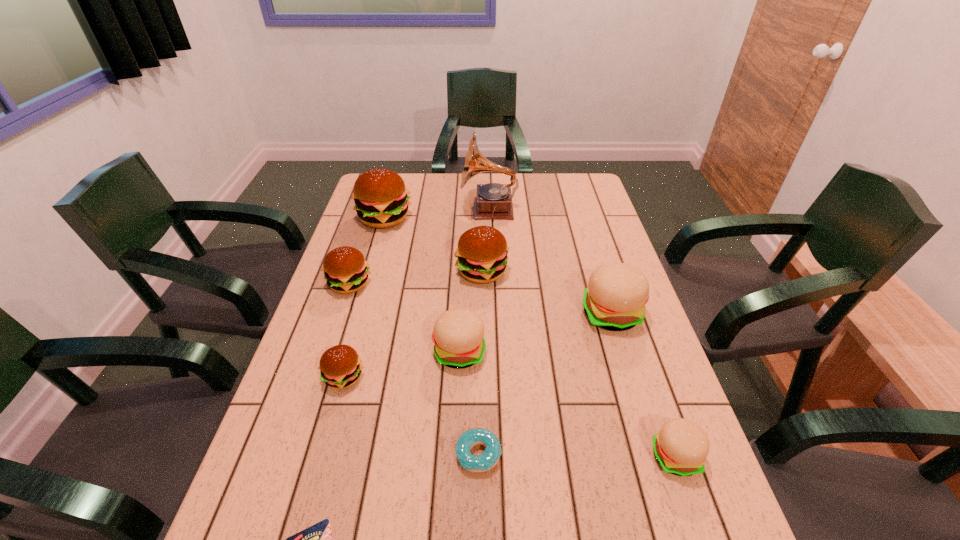
Where is `doughnut`? The image size is (960, 540). doughnut is located at coordinates (489, 458).

The image size is (960, 540). I want to click on vacant space located 0.110m on the horn of the tallest object, so click(431, 210).

The height and width of the screenshot is (540, 960). Identify the location of vacant space located 0.290m on the horn of the tallest object. (381, 210).

The height and width of the screenshot is (540, 960). Identify the location of vacant region located 0.150m on the horn of the tallest object. (420, 210).

At what (x,y) coordinates should I click in order to perform the action: click on vacant region located on the right of the ninth shortest object. Please return your answer as a coordinate pair (x, y). Image resolution: width=960 pixels, height=540 pixels. Looking at the image, I should click on (464, 219).

The image size is (960, 540). I want to click on free space located 0.340m on the left of the rightmost brown hamburger, so click(x=343, y=272).

Find the location of `vacant region located 0.160m on the back of the biggest beige hamburger`. vacant region located 0.160m on the back of the biggest beige hamburger is located at coordinates (594, 259).

Find the location of a particular element. free point located on the back of the third biggest brown hamburger is located at coordinates (x=365, y=239).

At what (x,y) coordinates should I click in order to perform the action: click on free region located on the right of the leftmost beige hamburger. Please return your answer as a coordinate pair (x, y). Image resolution: width=960 pixels, height=540 pixels. Looking at the image, I should click on (598, 352).

Locate an element on the screen. This screenshot has height=540, width=960. free region located 0.200m on the front of the smallest brown hamburger is located at coordinates (314, 483).